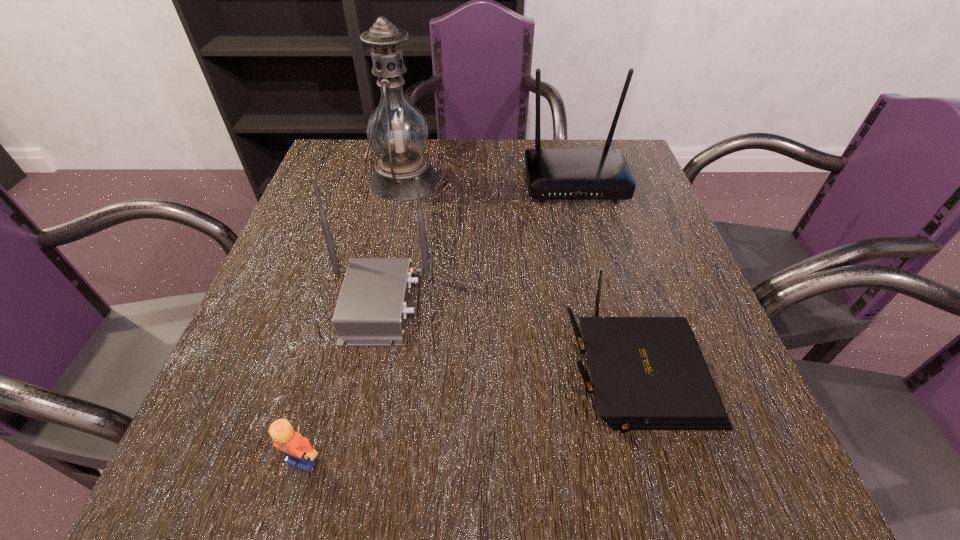
Where is `free location that satisfies the following two spatial constraints: 1. on the back side of the shortest router; 2. on the back of the leftmost router to connect cables`? The image size is (960, 540). free location that satisfies the following two spatial constraints: 1. on the back side of the shortest router; 2. on the back of the leftmost router to connect cables is located at coordinates (616, 303).

In order to click on free spot that satisfies the following two spatial constraints: 1. on the front-facing side of the farthest router; 2. on the right side of the shortest router in this screenshot , I will do `click(626, 375)`.

Image resolution: width=960 pixels, height=540 pixels. Find the location of `free point that satisfies the following two spatial constraints: 1. on the back of the leftmost router to connect cables; 2. on the left side of the shortest router`. free point that satisfies the following two spatial constraints: 1. on the back of the leftmost router to connect cables; 2. on the left side of the shortest router is located at coordinates (363, 375).